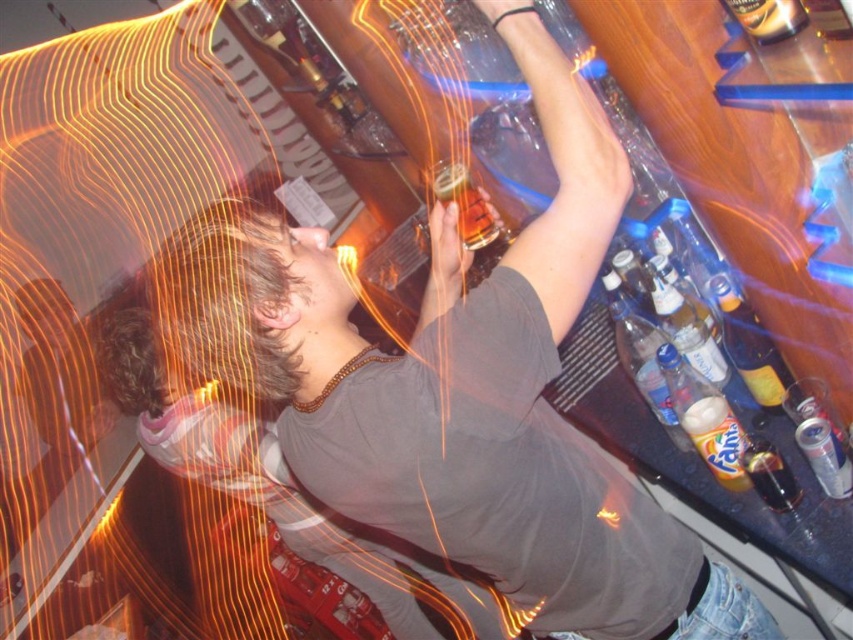
You are a customer at the bar and want to reach both the point at location [476,243] and the point at location [749,472]. Which point is closer to you?

The point at location [476,243] is closer to you because it is further to the viewer than the point at location [749,472].

What object is located at the coordinates point (465,204)?

The translucent amber glass at upper center is located at point (465,204).

You are a customer at the bar and want to grab the clear glass bottle at center. Considering your arm length is 2.5 feet, can you reach it without moving from your current position?

The clear glass bottle at center is 4.89 feet away from the camera, which is further than your arm length of 2.5 feet. Therefore, you cannot reach it without moving closer.